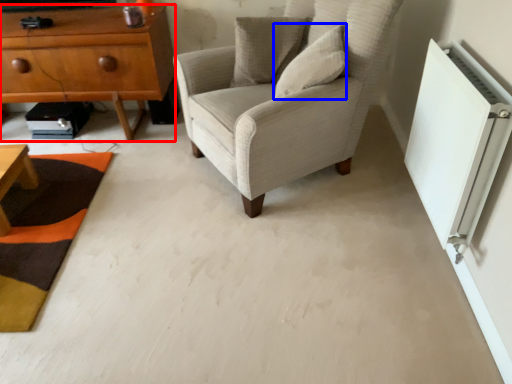
Question: Which of the following is the closest to the observer, chest of drawers (highlighted by a red box) or pillow (highlighted by a blue box)?

Choices:
 (A) chest of drawers
 (B) pillow

Answer: (B)